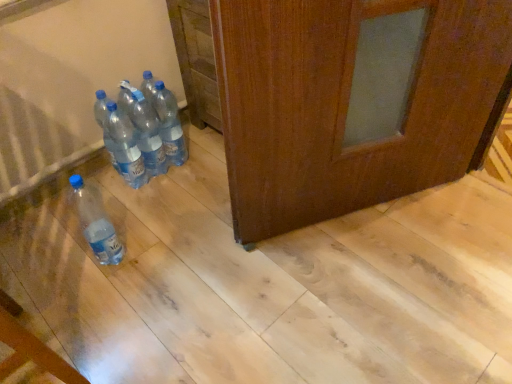
This screenshot has width=512, height=384. Identify the location of vacant area that lies between matte plastic bottle at lower left, which appears as the fourth bottle when viewed from the right, and clear plastic bottles at center, the second bottle from the left. (128, 216).